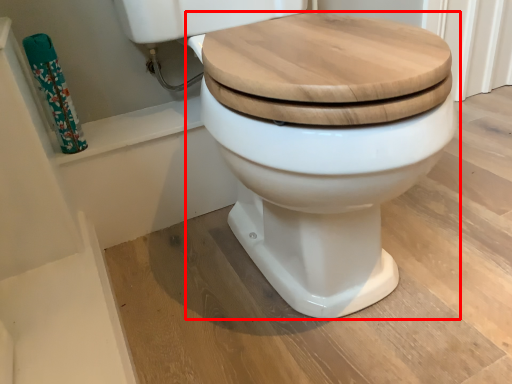
Question: From the image's perspective, where is toilet (annotated by the red box) located in relation to toilet paper in the image?

Choices:
 (A) below
 (B) above

Answer: (A)